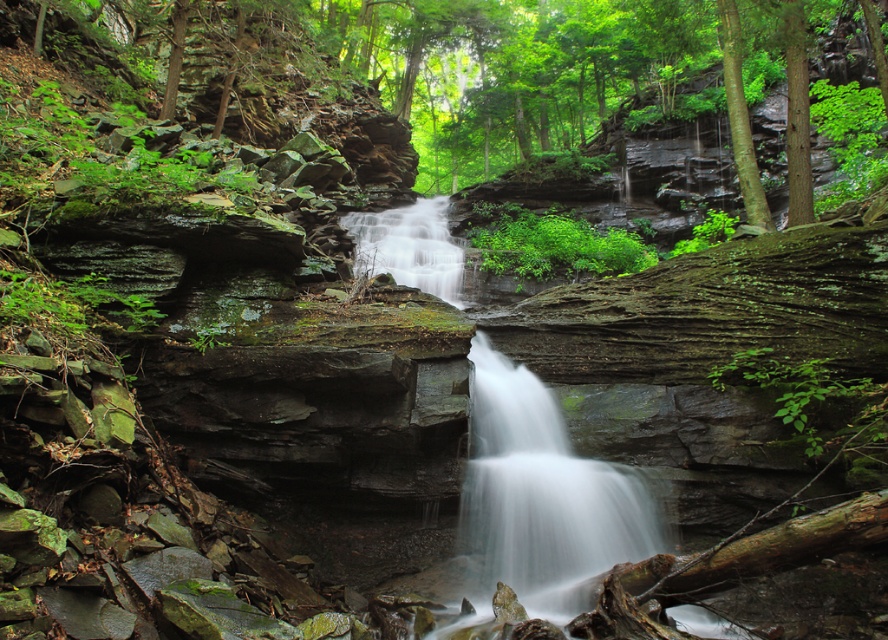
Who is positioned more to the right, smooth gray rock waterfall at center or white smooth water at center?

white smooth water at center is more to the right.

From the picture: Is smooth gray rock waterfall at center closer to camera compared to white smooth water at center?

Yes, smooth gray rock waterfall at center is closer to the viewer.

Identify the location of smooth gray rock waterfall at center. (538, 500).